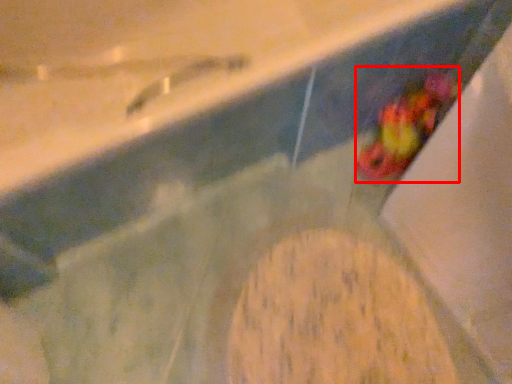
Question: From the image's perspective, what is the correct spatial relationship of food (annotated by the red box) in relation to food?

Choices:
 (A) below
 (B) above

Answer: (B)